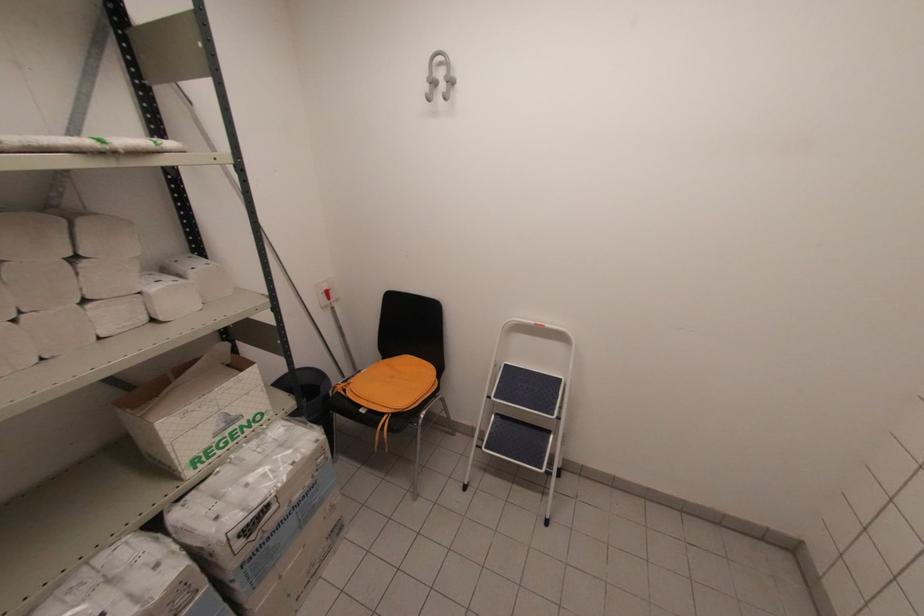
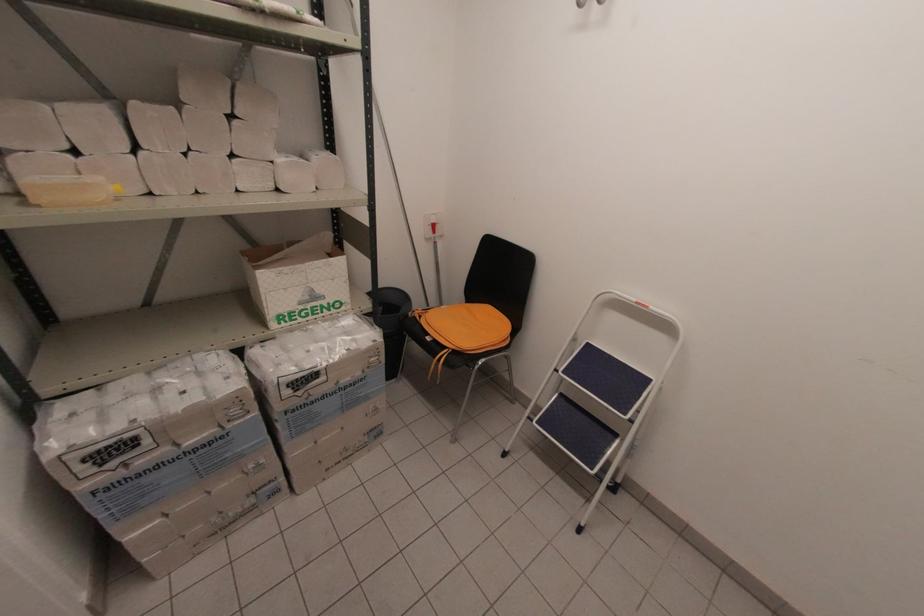
Locate, in the second image, the point that corresponds to point 325,437 in the first image.

(383, 341)